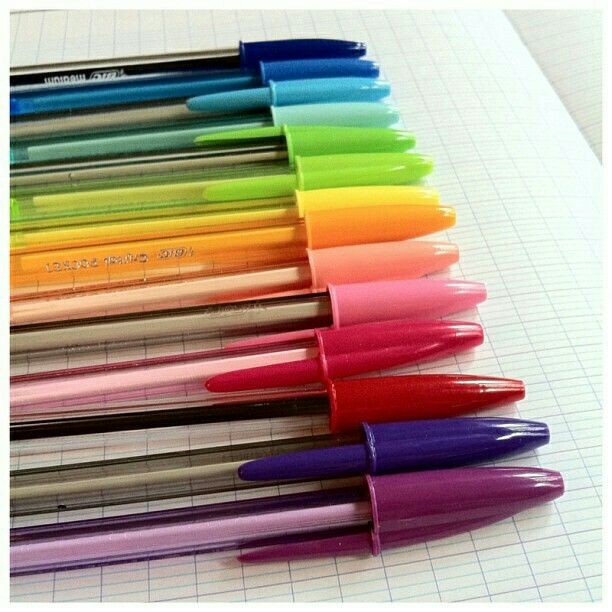
Locate an element on the screen. The height and width of the screenshot is (612, 612). green or blue pen caps is located at coordinates (336, 47), (344, 65), (341, 84), (354, 106), (357, 133), (364, 165).